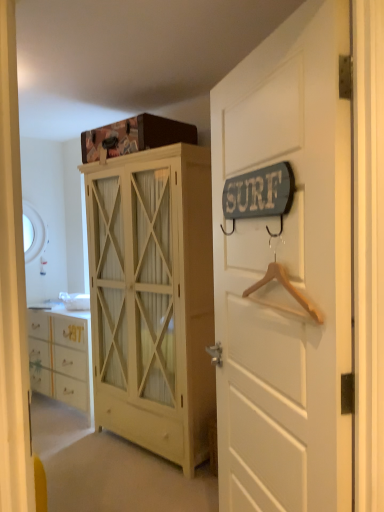
Question: Can you confirm if matte yellow cabinet at center is bigger than wooden hanger at right?

Choices:
 (A) no
 (B) yes

Answer: (B)

Question: Considering the relative sizes of matte yellow cabinet at center and wooden hanger at right in the image provided, is matte yellow cabinet at center thinner than wooden hanger at right?

Choices:
 (A) yes
 (B) no

Answer: (B)

Question: Is matte yellow cabinet at center closer to the viewer compared to wooden hanger at right?

Choices:
 (A) no
 (B) yes

Answer: (A)

Question: Is the depth of matte yellow cabinet at center greater than that of wooden hanger at right?

Choices:
 (A) no
 (B) yes

Answer: (B)

Question: Is matte yellow cabinet at center not inside wooden hanger at right?

Choices:
 (A) yes
 (B) no

Answer: (A)

Question: In the image, is white wood door at upper right on the left side or the right side of wooden hanger at right?

Choices:
 (A) left
 (B) right

Answer: (A)

Question: Is white wood door at upper right bigger or smaller than wooden hanger at right?

Choices:
 (A) small
 (B) big

Answer: (B)

Question: Is point (311, 457) positioned closer to the camera than point (301, 296)?

Choices:
 (A) closer
 (B) farther

Answer: (B)

Question: Which is correct: white wood door at upper right is inside wooden hanger at right, or outside of it?

Choices:
 (A) inside
 (B) outside

Answer: (B)

Question: In terms of height, does matte yellow cabinet at center look taller or shorter compared to white wood door at upper right?

Choices:
 (A) tall
 (B) short

Answer: (A)

Question: From the image's perspective, is matte yellow cabinet at center located above or below white wood door at upper right?

Choices:
 (A) above
 (B) below

Answer: (B)

Question: In terms of size, does matte yellow cabinet at center appear bigger or smaller than white wood door at upper right?

Choices:
 (A) small
 (B) big

Answer: (B)

Question: From a real-world perspective, is matte yellow cabinet at center above or below white wood door at upper right?

Choices:
 (A) below
 (B) above

Answer: (A)

Question: Looking at their shapes, would you say matte yellow cabinet at center is wider or thinner than wooden hanger at right?

Choices:
 (A) thin
 (B) wide

Answer: (B)

Question: From a real-world perspective, is matte yellow cabinet at center above or below wooden hanger at right?

Choices:
 (A) above
 (B) below

Answer: (B)